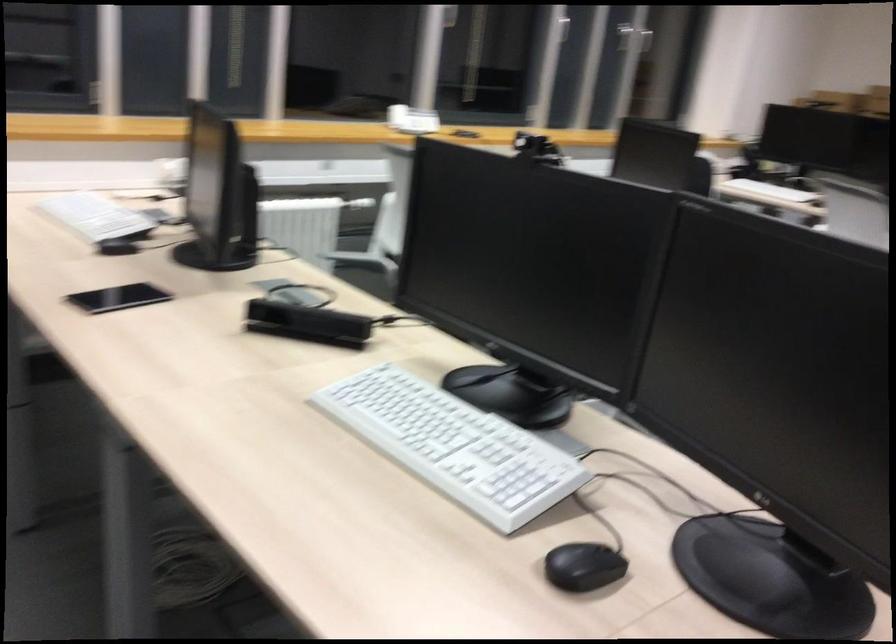
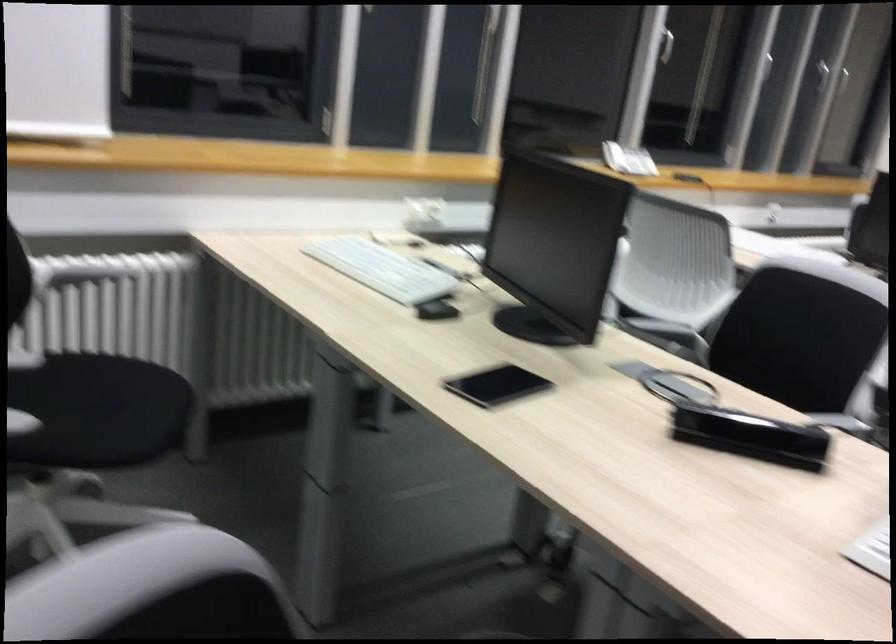
Question: The camera is either moving clockwise (left) or counter-clockwise (right) around the object. The first image is from the beginning of the video and the second image is from the end. Is the camera moving left or right when shooting the video?

Choices:
 (A) Left
 (B) Right

Answer: (B)